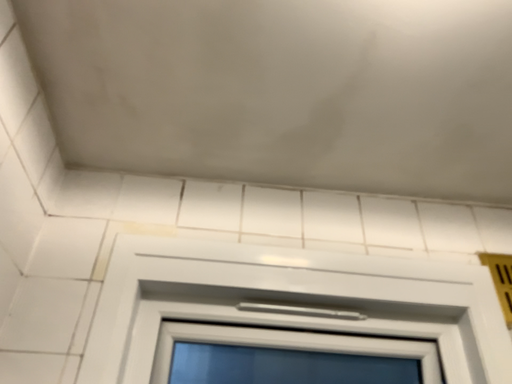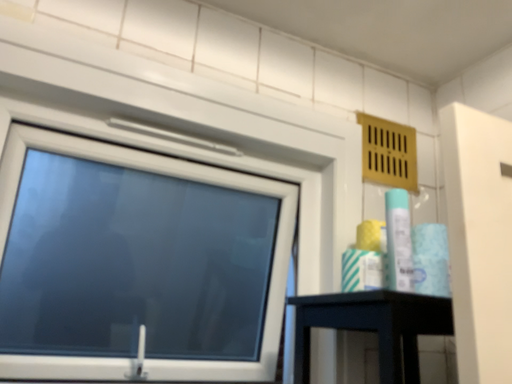
Question: Which way did the camera rotate in the video?

Choices:
 (A) rotated upward
 (B) rotated downward

Answer: (B)